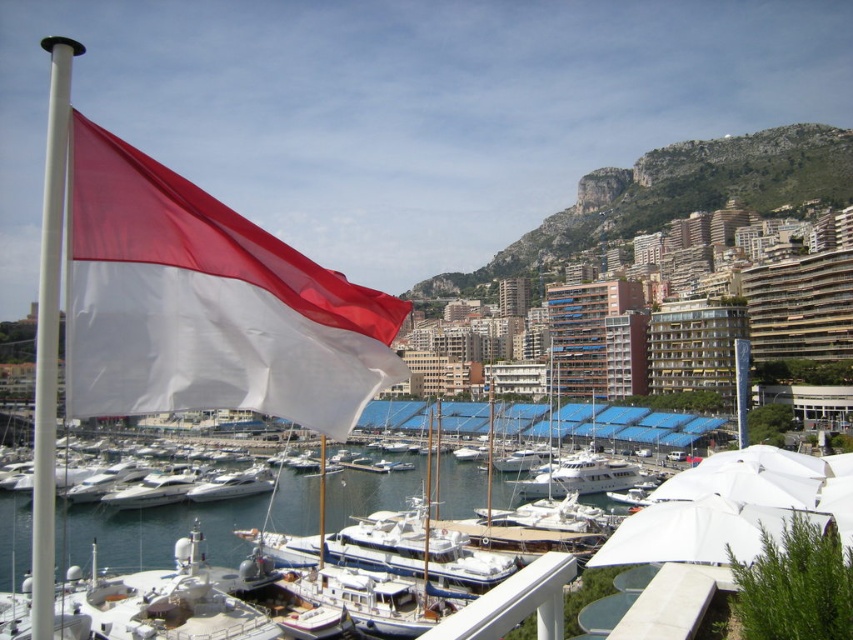
Question: Can you confirm if red/white fabric flag at left is smaller than white glossy boat at center?

Choices:
 (A) yes
 (B) no

Answer: (B)

Question: Can you confirm if red/white fabric flag at left is positioned above white glossy boat at center?

Choices:
 (A) yes
 (B) no

Answer: (A)

Question: Which point is closer to the camera?

Choices:
 (A) white glossy boat at center
 (B) red/white fabric flag at left

Answer: (B)

Question: Which of the following is the closest to the observer?

Choices:
 (A) white glossy boat at center
 (B) red/white fabric flag at left

Answer: (B)

Question: Is red/white fabric flag at left to the left of white glossy boat at center from the viewer's perspective?

Choices:
 (A) no
 (B) yes

Answer: (A)

Question: Which point is farther to the camera?

Choices:
 (A) white glossy boat at center
 (B) red/white fabric flag at left

Answer: (A)